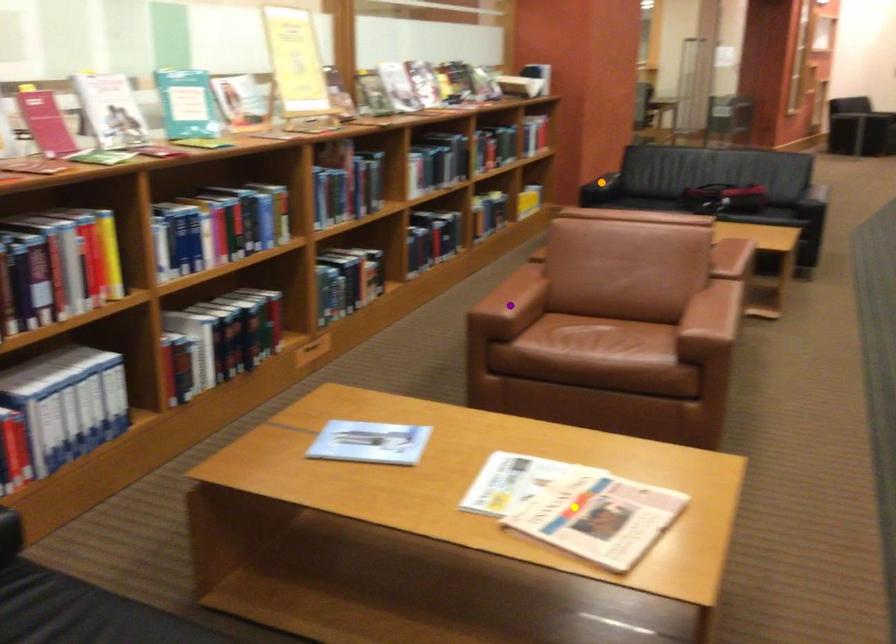
Order these from nearest to farthest:
1. yellow point
2. purple point
3. orange point

1. yellow point
2. purple point
3. orange point